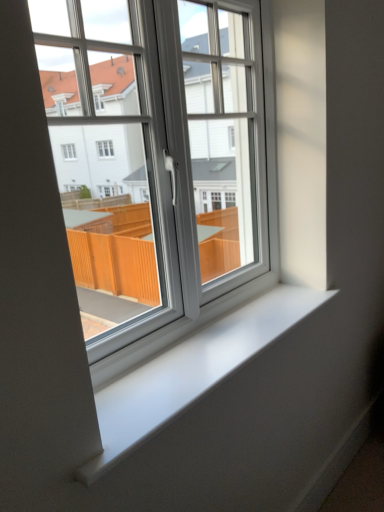
Where is `free space above white smooth window sill at center (from a real-world perspective)`? This screenshot has height=512, width=384. free space above white smooth window sill at center (from a real-world perspective) is located at coordinates (211, 343).